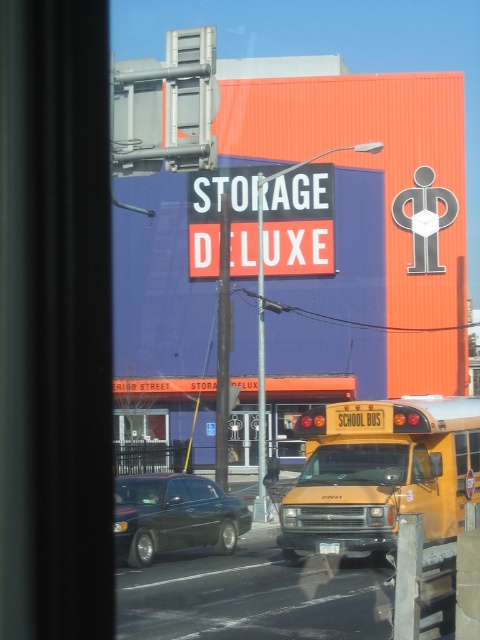
Question: Considering the real-world distances, which object is closest to the shiny black sedan at lower left?

Choices:
 (A) yellow matte/solid school bus at center
 (B) red matte sign at center

Answer: (A)

Question: Does yellow matte/solid school bus at center have a lesser width compared to shiny black sedan at lower left?

Choices:
 (A) yes
 (B) no

Answer: (A)

Question: Is yellow matte/solid school bus at center to the right of shiny black sedan at lower left from the viewer's perspective?

Choices:
 (A) yes
 (B) no

Answer: (A)

Question: Considering the real-world distances, which object is farthest from the red matte sign at center?

Choices:
 (A) shiny black sedan at lower left
 (B) yellow matte/solid school bus at center

Answer: (B)

Question: Which of the following is the farthest from the observer?

Choices:
 (A) (429, 536)
 (B) (298, 236)

Answer: (B)

Question: Observing the image, what is the correct spatial positioning of yellow matte/solid school bus at center in reference to shiny black sedan at lower left?

Choices:
 (A) below
 (B) above

Answer: (B)